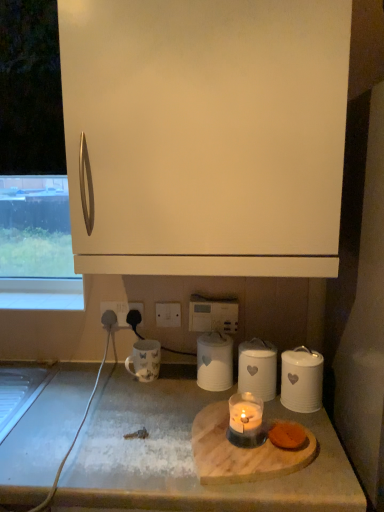
In order to click on vacant space situated on the left part of translucent glass candle at center in this screenshot , I will do 151,442.